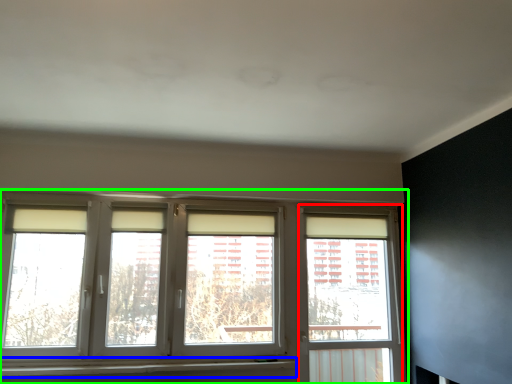
Question: Considering the real-world distances, which object is farthest from window frame (highlighted by a red box)? window sill (highlighted by a blue box) or window (highlighted by a green box)?

Choices:
 (A) window sill
 (B) window

Answer: (A)